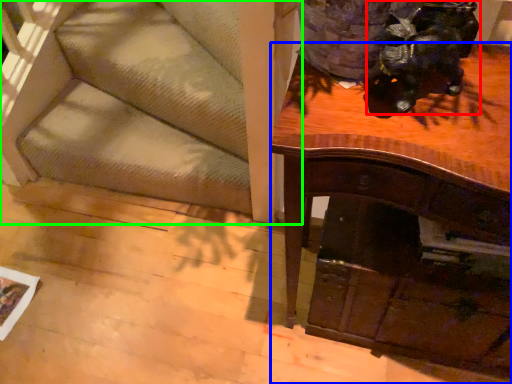
Question: Which object is positioned farthest from animal (highlighted by a red box)? Select from desk (highlighted by a blue box) and furniture (highlighted by a green box).

Choices:
 (A) desk
 (B) furniture

Answer: (B)